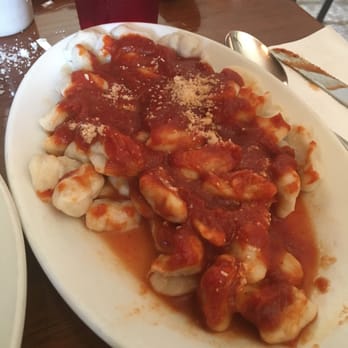
The height and width of the screenshot is (348, 348). Identify the location of table. (34, 326), (19, 64), (249, 18).